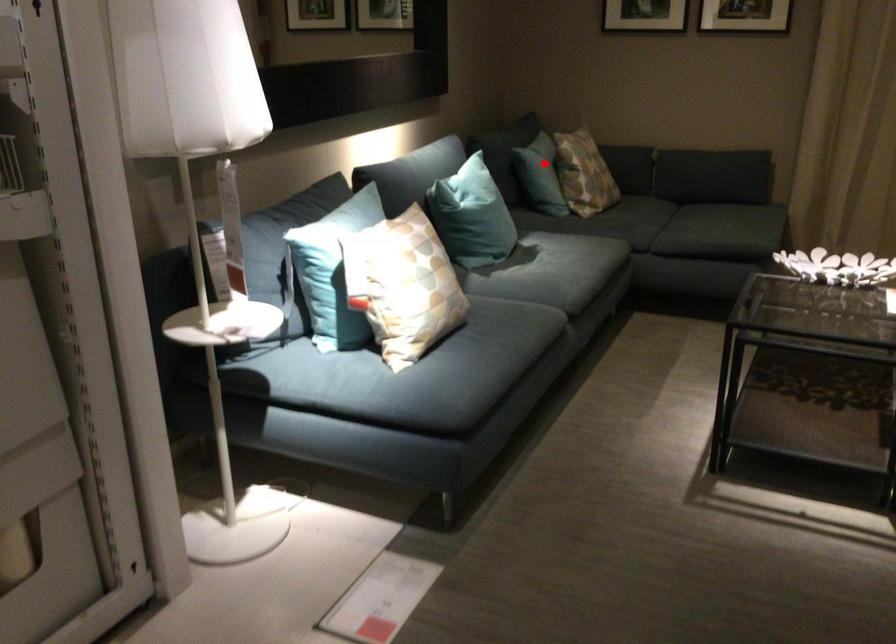
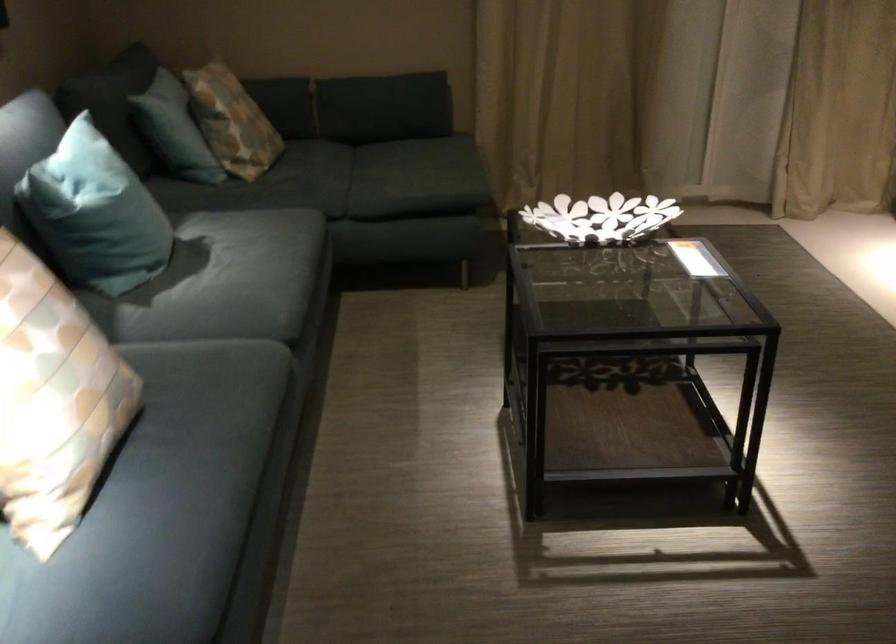
The point at the highlighted location is marked in the first image. Where is the corresponding point in the second image?

(174, 129)